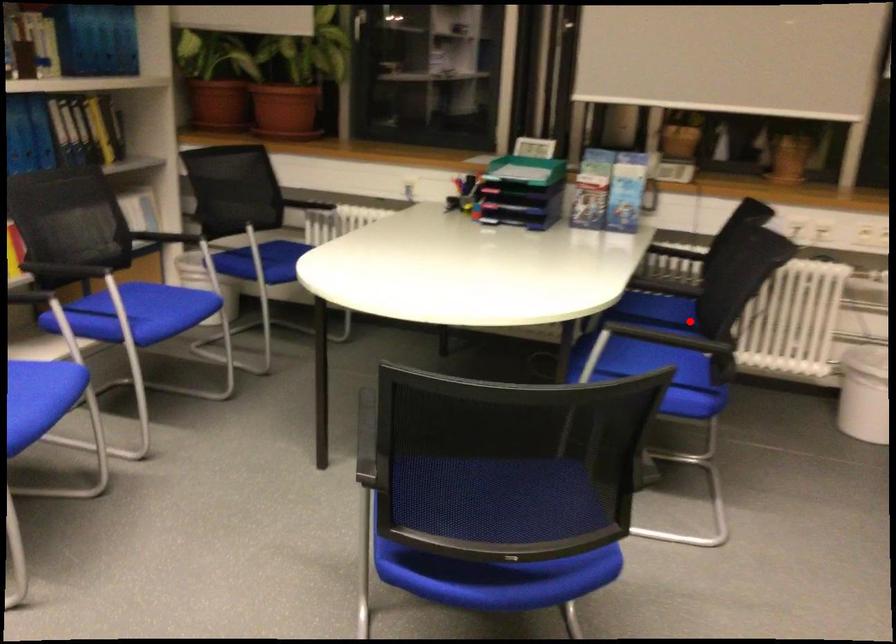
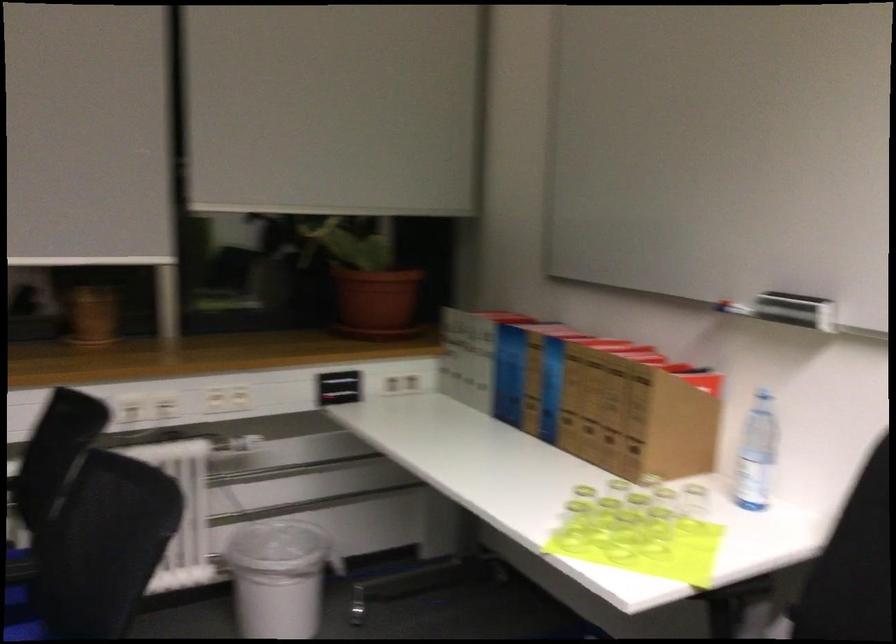
Question: I am providing you with two images of the same scene from different viewpoints. Given a red point in image1, look at the same physical point in image2. Is it:

Choices:
 (A) Closer to the viewpoint
 (B) Farther from the viewpoint

Answer: (A)